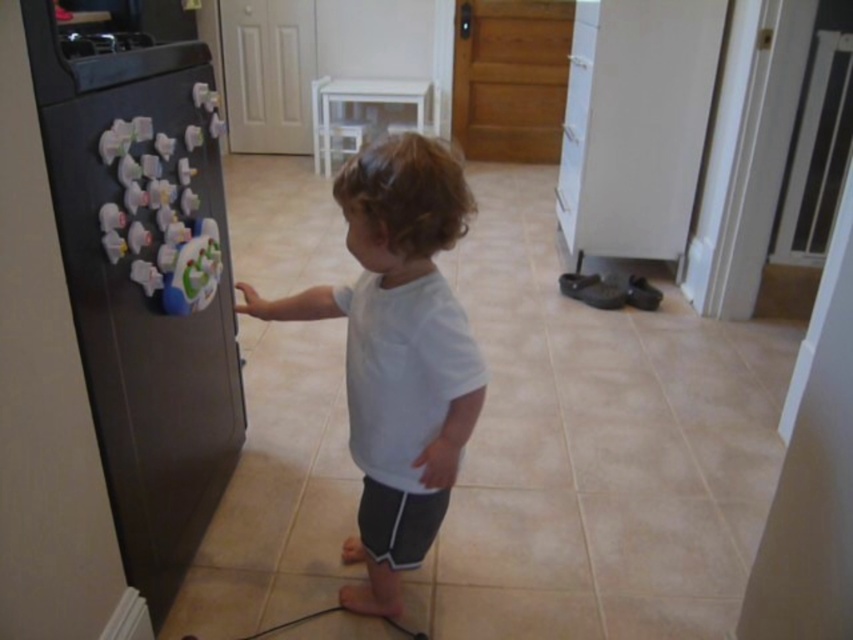
Question: Which of the following is the farthest from the observer?

Choices:
 (A) (154, 208)
 (B) (357, 285)

Answer: (B)

Question: Which point is closer to the camera?

Choices:
 (A) (190, 140)
 (B) (373, 413)

Answer: (B)

Question: Is black matte refrigerator at left above white matte shirt at center?

Choices:
 (A) yes
 (B) no

Answer: (A)

Question: Is black matte refrigerator at left below white matte shirt at center?

Choices:
 (A) yes
 (B) no

Answer: (B)

Question: Is black matte refrigerator at left positioned behind white matte shirt at center?

Choices:
 (A) yes
 (B) no

Answer: (B)

Question: Which of the following is the farthest from the observer?

Choices:
 (A) click(x=228, y=440)
 (B) click(x=387, y=536)

Answer: (A)